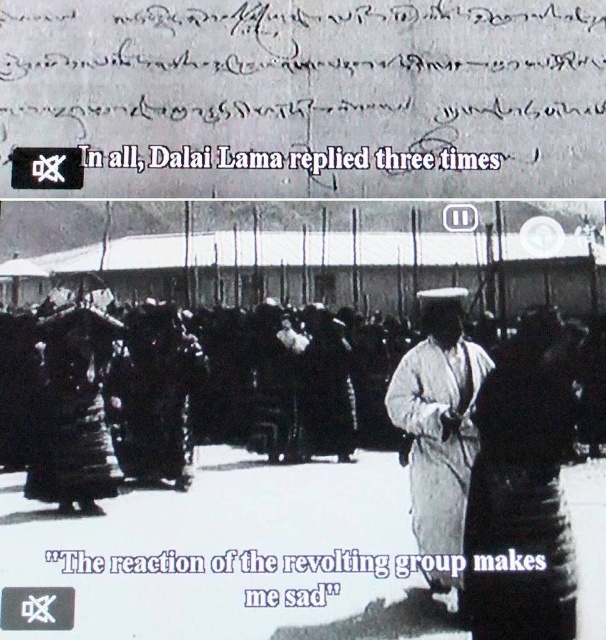
You are a fashion historian examining the image. You need to determine if you can comfortably reach out to touch the dark fabric dress at center without moving your position. Your arm can extend 3 feet. Can you reach it?

The dark fabric dress at center is 3.59 feet away from the viewer. Since your arm can only extend 3 feet, you cannot reach the dress.

Based on the photo, you are a fashion historian examining the image. The top section contains historical documents, while the bottom section shows a dark fabric dress at center. Can you identify the object located at coordinate point (522, 488)?

The point at coordinate (522, 488) corresponds to the dark fabric dress at center.